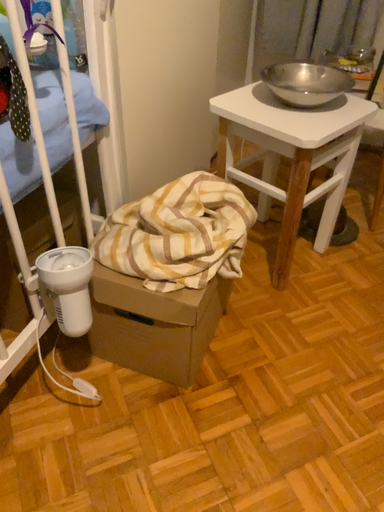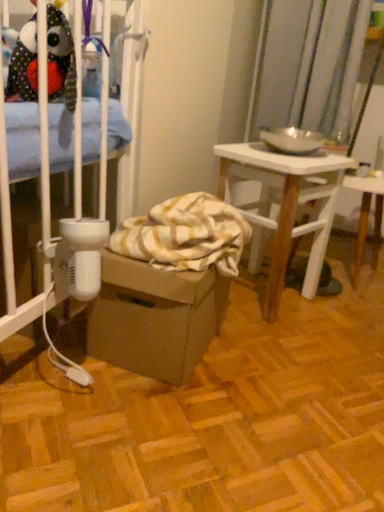
Question: How did the camera likely rotate when shooting the video?

Choices:
 (A) rotated downward
 (B) rotated upward

Answer: (B)